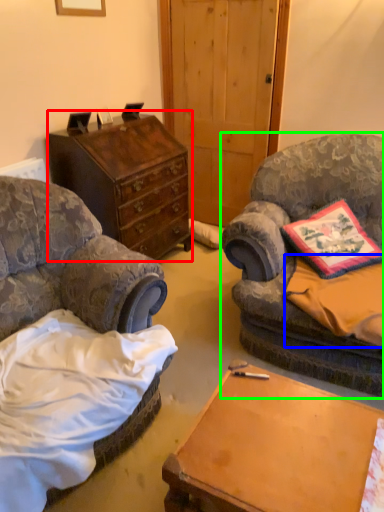
Question: Which object is positioned farthest from chest of drawers (highlighted by a red box)? Select from sheet (highlighted by a blue box) and chair (highlighted by a green box).

Choices:
 (A) sheet
 (B) chair

Answer: (A)